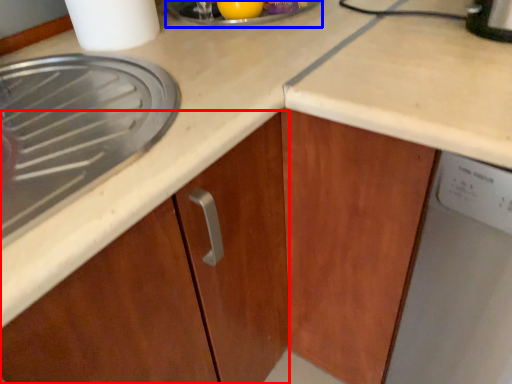
Question: Which of the following is the closest to the observer, cabinetry (highlighted by a red box) or appliance (highlighted by a blue box)?

Choices:
 (A) cabinetry
 (B) appliance

Answer: (A)